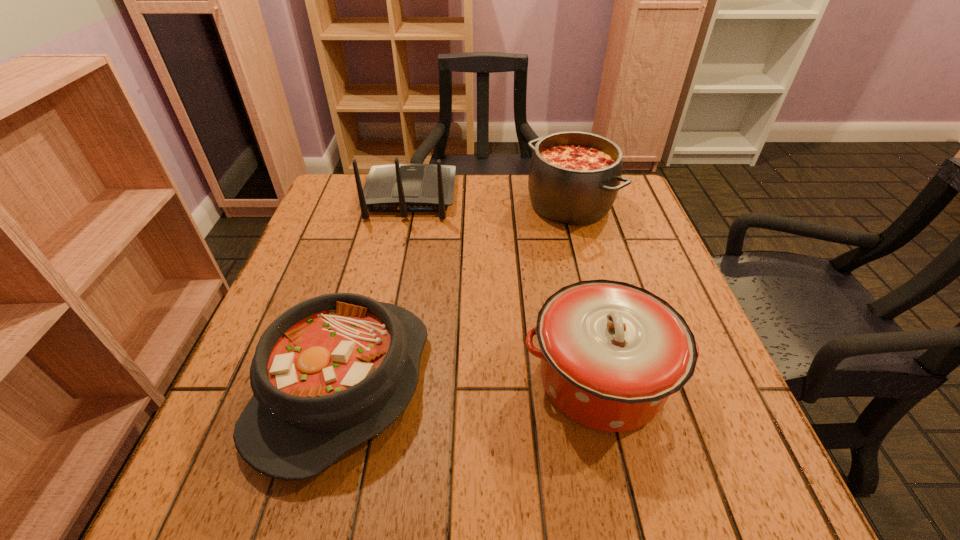
Identify the location of vacant space that is in between the router and the farthest casserole. (490, 200).

The width and height of the screenshot is (960, 540). I want to click on free space between the leftmost casserole and the farthest casserole, so click(456, 295).

The height and width of the screenshot is (540, 960). In order to click on vacant region between the router and the farthest casserole in this screenshot , I will do `click(490, 200)`.

Where is `vacant area that lies between the router and the shortest object`? This screenshot has width=960, height=540. vacant area that lies between the router and the shortest object is located at coordinates pyautogui.click(x=376, y=291).

Locate an element on the screen. The width and height of the screenshot is (960, 540). free spot between the farthest casserole and the shortest casserole is located at coordinates (456, 295).

Where is `free point between the farthest casserole and the leftmost casserole`? free point between the farthest casserole and the leftmost casserole is located at coordinates (456, 295).

This screenshot has height=540, width=960. I want to click on the second closest object to the farthest casserole, so click(x=612, y=353).

Where is `object that is the closest to the router`? The height and width of the screenshot is (540, 960). object that is the closest to the router is located at coordinates (574, 177).

Select which casserole appears as the second closest to the shortest casserole. Please provide its 2D coordinates. Your answer should be formatted as a tuple, i.e. [(x, y)], where the tuple contains the x and y coordinates of a point satisfying the conditions above.

[(574, 177)]

In order to click on the closest casserole to the farthest casserole in this screenshot , I will do `click(612, 353)`.